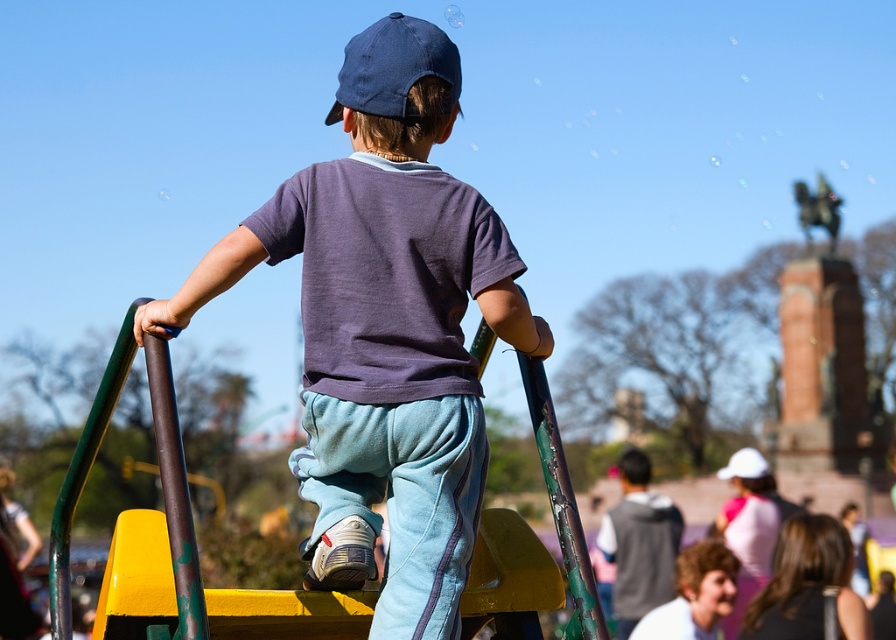
Question: Is matte blue cap at center to the right of blue denim baseball cap at upper center from the viewer's perspective?

Choices:
 (A) yes
 (B) no

Answer: (B)

Question: Can you confirm if matte blue cap at center is smaller than blue denim baseball cap at upper center?

Choices:
 (A) yes
 (B) no

Answer: (B)

Question: Which of the following is the closest to the observer?

Choices:
 (A) matte blue cap at center
 (B) blue denim baseball cap at upper center

Answer: (A)

Question: Where is matte blue cap at center located in relation to blue denim baseball cap at upper center in the image?

Choices:
 (A) below
 (B) above

Answer: (A)

Question: Among these objects, which one is farthest from the camera?

Choices:
 (A) matte blue cap at center
 (B) blue denim baseball cap at upper center

Answer: (B)